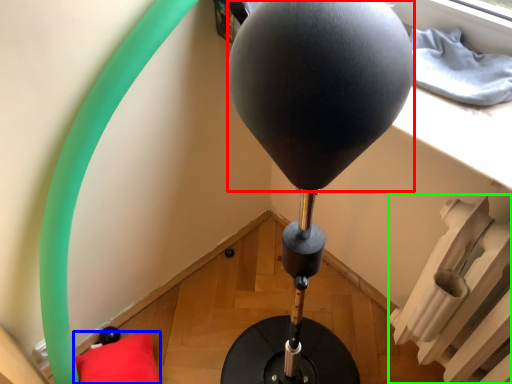
Question: Which object is the closest to the balloon (highlighted by a red box)? Choose among these: pillow (highlighted by a blue box) or radiator (highlighted by a green box).

Choices:
 (A) pillow
 (B) radiator

Answer: (B)